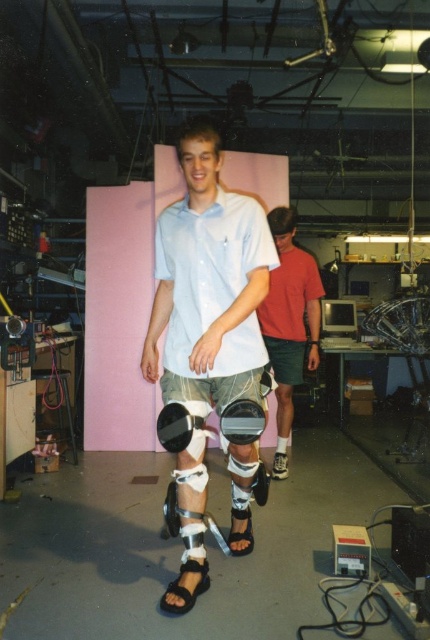
Question: Where is white matte knee brace at center located in relation to matte black knee pad at center in the image?

Choices:
 (A) right
 (B) left

Answer: (B)

Question: Which is nearer to the matte black knee pad at center?

Choices:
 (A) white matte knee brace at center
 (B) black matte knee pad at center

Answer: (B)

Question: Considering the relative positions of matte white shorts at center and matte black knee pad at center in the image provided, where is matte white shorts at center located with respect to matte black knee pad at center?

Choices:
 (A) above
 (B) below

Answer: (A)

Question: Considering the real-world distances, which object is closest to the matte white shirt at center?

Choices:
 (A) black leather sandal at lower center
 (B) black matte knee pad at center
 (C) matte white shorts at center

Answer: (B)

Question: Which of the following is the farthest from the observer?

Choices:
 (A) matte white shorts at center
 (B) black leather sandal at lower center
 (C) white matte knee brace at center
 (D) matte white shirt at center

Answer: (A)

Question: In this image, where is black matte knee pad at center located relative to matte black knee pad at center?

Choices:
 (A) left
 (B) right

Answer: (A)